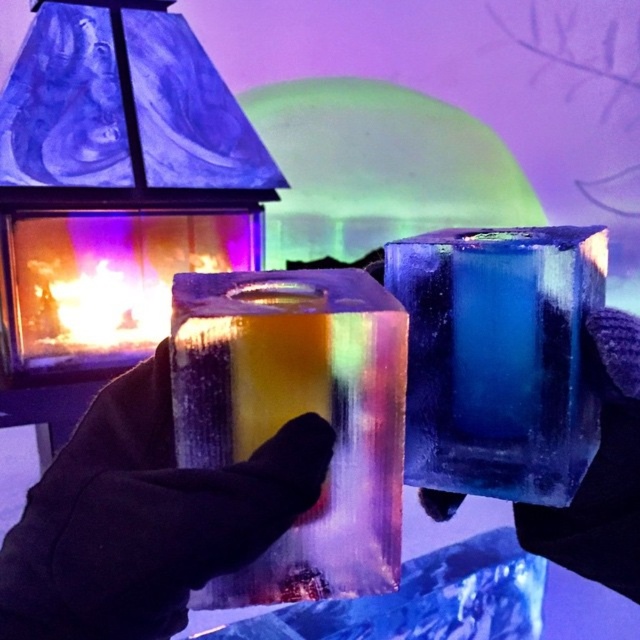
Question: From the image, what is the correct spatial relationship of translucent ice cube at center in relation to translucent rainbow ice cube at center?

Choices:
 (A) right
 (B) left

Answer: (B)

Question: Which object appears closest to the camera in this image?

Choices:
 (A) translucent ice cube at center
 (B) translucent rainbow ice cube at center

Answer: (B)

Question: Can you confirm if translucent ice cube at center is wider than translucent rainbow ice cube at center?

Choices:
 (A) yes
 (B) no

Answer: (A)

Question: Which of the following is the closest to the observer?

Choices:
 (A) (109, 344)
 (B) (340, 464)

Answer: (B)

Question: Does translucent ice cube at center appear on the right side of translucent rainbow ice cube at center?

Choices:
 (A) no
 (B) yes

Answer: (A)

Question: Among these objects, which one is farthest from the camera?

Choices:
 (A) translucent rainbow ice cube at center
 (B) translucent ice cube at center

Answer: (B)